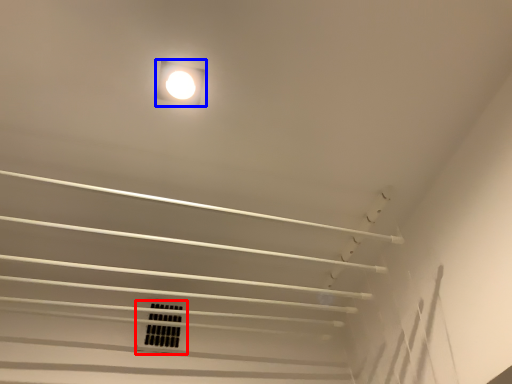
Question: Which of the following is the closest to the observer, window (highlighted by a red box) or lamp (highlighted by a blue box)?

Choices:
 (A) window
 (B) lamp

Answer: (B)